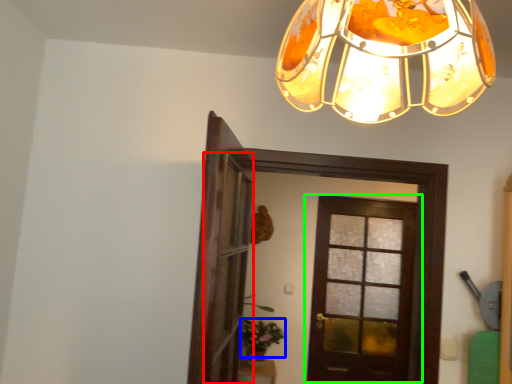
Question: Which object is the closest to the screen door (highlighted by a red box)? Choose among these: plant (highlighted by a blue box) or door (highlighted by a green box).

Choices:
 (A) plant
 (B) door

Answer: (A)